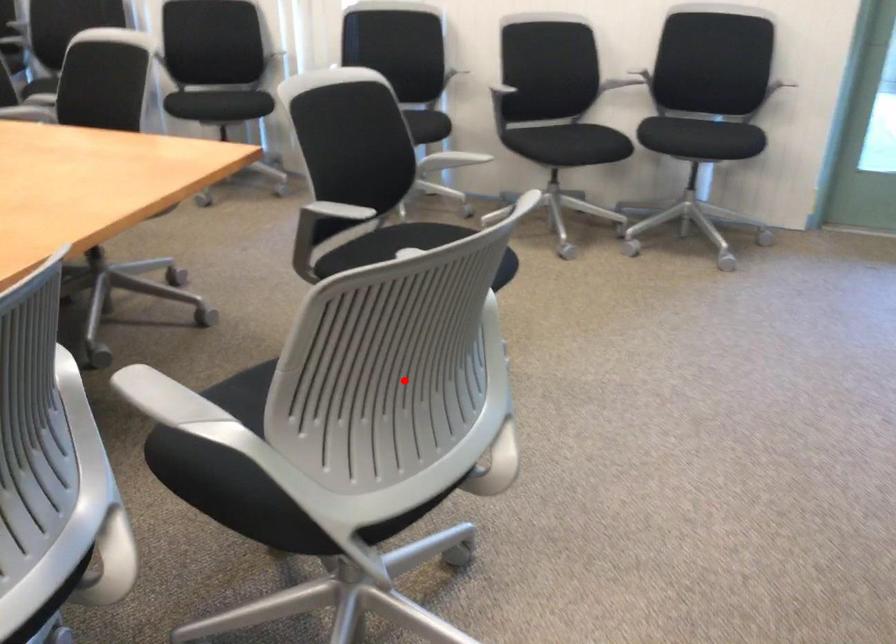
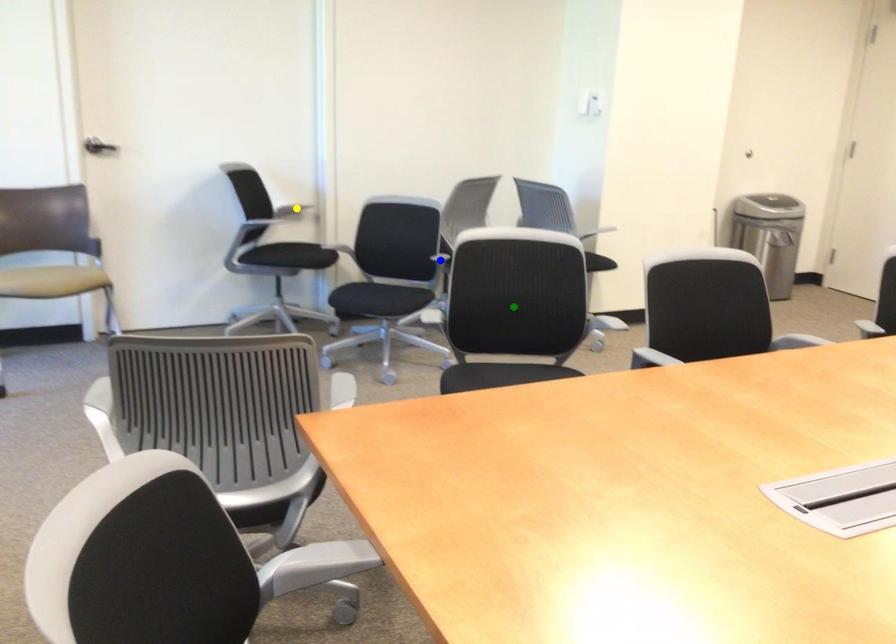
Question: I am providing you with two images of the same scene from different viewpoints. A red point is marked on the first image. You are given multiple points on the second image. Can you choose the point in image 2 that corresponds to the point in image 1?

Choices:
 (A) blue point
 (B) yellow point
 (C) green point

Answer: (C)